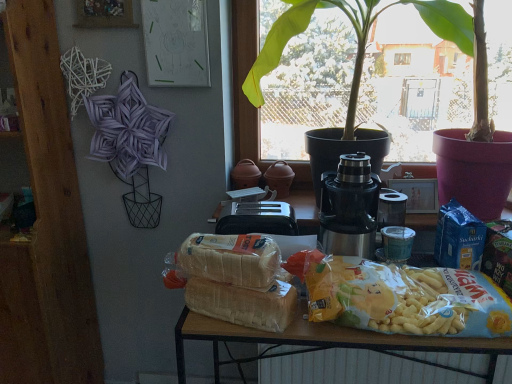
Question: Is matte plastic table at center to the right of translucent plastic bag of chips at center, arranged as the first yoghurt when viewed from the left, from the viewer's perspective?

Choices:
 (A) no
 (B) yes

Answer: (B)

Question: Can you confirm if matte plastic table at center is taller than translucent plastic bag of chips at center, which is counted as the 3th yoghurt, starting from the right?

Choices:
 (A) no
 (B) yes

Answer: (B)

Question: Is matte plastic table at center bigger than translucent plastic bag of chips at center, arranged as the first yoghurt when viewed from the left?

Choices:
 (A) yes
 (B) no

Answer: (A)

Question: Considering the relative sizes of matte plastic table at center and translucent plastic bag of chips at center, which is counted as the 3th yoghurt, starting from the right, in the image provided, is matte plastic table at center thinner than translucent plastic bag of chips at center, which is counted as the 3th yoghurt, starting from the right,?

Choices:
 (A) no
 (B) yes

Answer: (A)

Question: Is matte plastic table at center at the left side of translucent plastic bag of chips at center, arranged as the first yoghurt when viewed from the left?

Choices:
 (A) yes
 (B) no

Answer: (B)

Question: From the image's perspective, is green leafy plant at center above or below translucent plastic bag of chips at center, which is counted as the 3th yoghurt, starting from the right?

Choices:
 (A) above
 (B) below

Answer: (A)

Question: Considering the positions of green leafy plant at center and translucent plastic bag of chips at center, which is counted as the 3th yoghurt, starting from the right, in the image, is green leafy plant at center wider or thinner than translucent plastic bag of chips at center, which is counted as the 3th yoghurt, starting from the right,?

Choices:
 (A) wide
 (B) thin

Answer: (A)

Question: From a real-world perspective, is green leafy plant at center physically located above or below translucent plastic bag of chips at center, arranged as the first yoghurt when viewed from the left?

Choices:
 (A) above
 (B) below

Answer: (A)

Question: From their relative heights in the image, would you say green leafy plant at center is taller or shorter than translucent plastic bag of chips at center, which is counted as the 3th yoghurt, starting from the right?

Choices:
 (A) short
 (B) tall

Answer: (B)

Question: Is satin silver thermos at center, placed as the 2th yoghurt when sorted from right to left, bigger or smaller than blue foil packet at right, marked as the first yoghurt in a right-to-left arrangement?

Choices:
 (A) big
 (B) small

Answer: (A)

Question: Is satin silver thermos at center, placed as the 2th yoghurt when sorted from right to left, wider or thinner than blue foil packet at right, marked as the first yoghurt in a right-to-left arrangement?

Choices:
 (A) thin
 (B) wide

Answer: (B)

Question: Is satin silver thermos at center, placed as the 2th yoghurt when sorted from right to left, situated inside blue foil packet at right, acting as the third yoghurt starting from the left, or outside?

Choices:
 (A) outside
 (B) inside

Answer: (A)

Question: Would you say satin silver thermos at center, the second yoghurt from the left, is to the left or to the right of blue foil packet at right, acting as the third yoghurt starting from the left, in the picture?

Choices:
 (A) left
 (B) right

Answer: (A)

Question: Looking at the image, does satin silver thermos at center, placed as the 2th yoghurt when sorted from right to left, seem bigger or smaller compared to matte plastic table at center?

Choices:
 (A) small
 (B) big

Answer: (A)

Question: Is satin silver thermos at center, placed as the 2th yoghurt when sorted from right to left, to the left or to the right of matte plastic table at center in the image?

Choices:
 (A) right
 (B) left

Answer: (B)